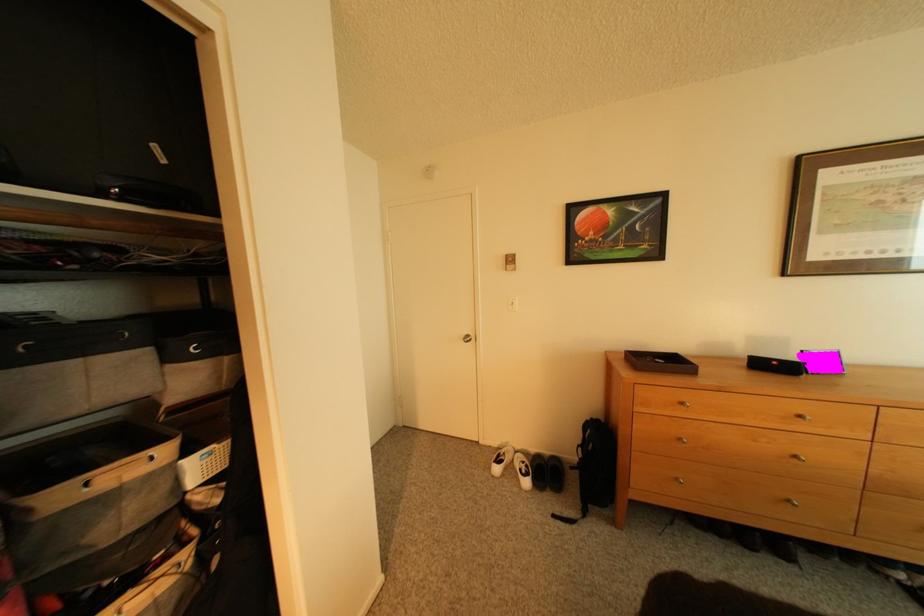
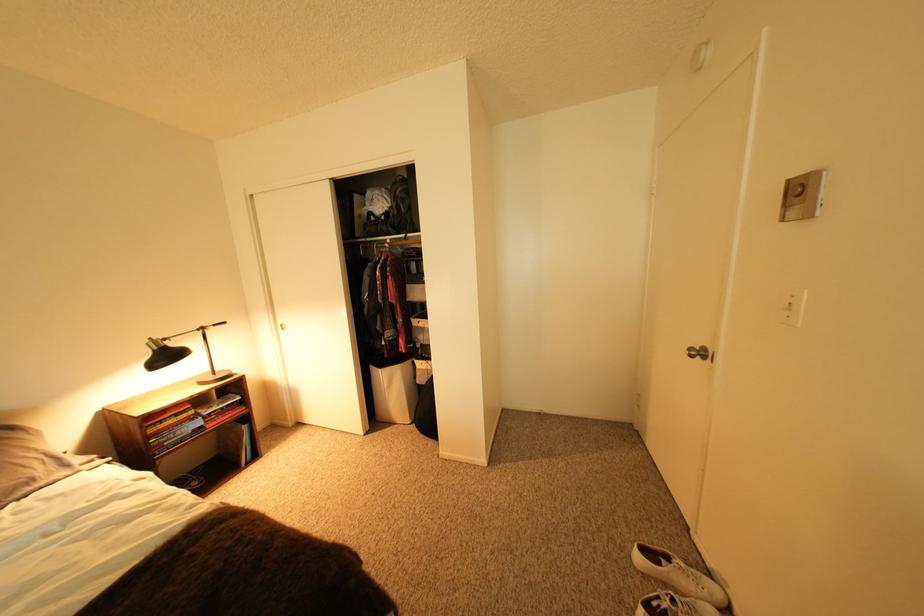
Where in the second image is the point corresponding to point 509,471 from the first image?

(651, 560)